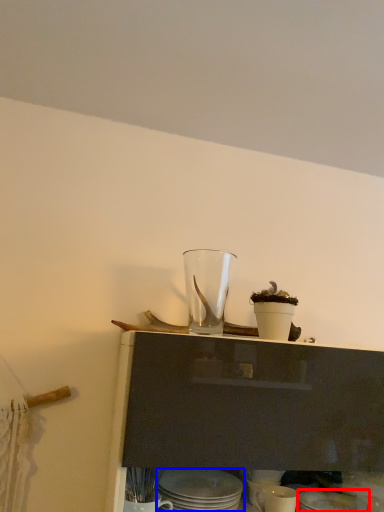
Question: Among these objects, which one is farthest to the camera, tableware (highlighted by a red box) or tableware (highlighted by a blue box)?

Choices:
 (A) tableware
 (B) tableware

Answer: (A)